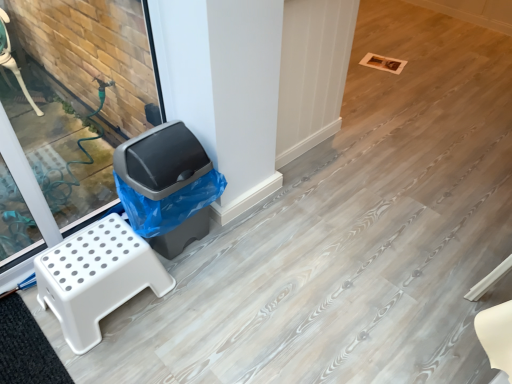
Question: Could you tell me if white plastic step stool at left is facing gray plastic trash can at left?

Choices:
 (A) no
 (B) yes

Answer: (A)

Question: Does white plastic step stool at left have a lesser height compared to gray plastic trash can at left?

Choices:
 (A) no
 (B) yes

Answer: (B)

Question: From a real-world perspective, is white plastic step stool at left on gray plastic trash can at left?

Choices:
 (A) yes
 (B) no

Answer: (B)

Question: Can you confirm if white plastic step stool at left is thinner than gray plastic trash can at left?

Choices:
 (A) no
 (B) yes

Answer: (A)

Question: Is white plastic step stool at left in contact with gray plastic trash can at left?

Choices:
 (A) no
 (B) yes

Answer: (A)

Question: Considering the relative positions of white plastic step stool at left and gray plastic trash can at left in the image provided, is white plastic step stool at left behind gray plastic trash can at left?

Choices:
 (A) no
 (B) yes

Answer: (A)

Question: Does black rubber mat at lower left have a lesser width compared to white plastic step stool at left?

Choices:
 (A) yes
 (B) no

Answer: (A)

Question: From the image's perspective, is black rubber mat at lower left below white plastic step stool at left?

Choices:
 (A) yes
 (B) no

Answer: (A)

Question: Is black rubber mat at lower left to the right of white plastic step stool at left from the viewer's perspective?

Choices:
 (A) yes
 (B) no

Answer: (B)

Question: Is the depth of black rubber mat at lower left less than that of white plastic step stool at left?

Choices:
 (A) yes
 (B) no

Answer: (A)

Question: Can you confirm if black rubber mat at lower left is bigger than white plastic step stool at left?

Choices:
 (A) yes
 (B) no

Answer: (B)

Question: Does black rubber mat at lower left have a greater width compared to white plastic step stool at left?

Choices:
 (A) yes
 (B) no

Answer: (B)

Question: From the image's perspective, is white plastic step stool at left under black rubber mat at lower left?

Choices:
 (A) yes
 (B) no

Answer: (B)